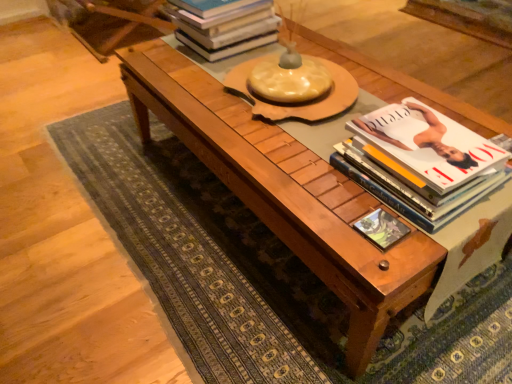
Question: Is hardcover books at upper center, which is the 1th book in top-to-bottom order, to the right of white glossy book at right, which is the 2th book in back-to-front order, from the viewer's perspective?

Choices:
 (A) no
 (B) yes

Answer: (A)

Question: Is hardcover books at upper center, positioned as the 2th book in right-to-left order, to the left of white glossy book at right, the 2th book from the top, from the viewer's perspective?

Choices:
 (A) no
 (B) yes

Answer: (B)

Question: Would you say hardcover books at upper center, which is counted as the 1th book, starting from the left, is a long distance from white glossy book at right, which is counted as the 1th book, starting from the front?

Choices:
 (A) no
 (B) yes

Answer: (A)

Question: From the image's perspective, is hardcover books at upper center, acting as the second book starting from the front, on white glossy book at right, positioned as the second book in left-to-right order?

Choices:
 (A) no
 (B) yes

Answer: (B)

Question: From a real-world perspective, is hardcover books at upper center, positioned as the 2th book in right-to-left order, below white glossy book at right, positioned as the second book in left-to-right order?

Choices:
 (A) yes
 (B) no

Answer: (B)

Question: Looking at the image, does hardcover books at upper center, which is counted as the 1th book, starting from the left, seem bigger or smaller compared to matte green book at center?

Choices:
 (A) small
 (B) big

Answer: (B)

Question: Is hardcover books at upper center, which is counted as the 1th book, starting from the left, in front of or behind matte green book at center in the image?

Choices:
 (A) behind
 (B) front

Answer: (A)

Question: Based on their positions, is hardcover books at upper center, positioned as the 2th book in right-to-left order, located to the left or right of matte green book at center?

Choices:
 (A) right
 (B) left

Answer: (B)

Question: From a real-world perspective, relative to matte green book at center, is hardcover books at upper center, positioned as the 2th book in right-to-left order, vertically above or below?

Choices:
 (A) below
 (B) above

Answer: (B)

Question: Based on their sizes in the image, would you say wooden coffee table at center is bigger or smaller than white glossy book at right, positioned as the second book in left-to-right order?

Choices:
 (A) big
 (B) small

Answer: (A)

Question: Considering the positions of wooden coffee table at center and white glossy book at right, which is the 1th book from bottom to top, in the image, is wooden coffee table at center taller or shorter than white glossy book at right, which is the 1th book from bottom to top,?

Choices:
 (A) short
 (B) tall

Answer: (B)

Question: From the image's perspective, is wooden coffee table at center positioned above or below white glossy book at right, the first book positioned from the right?

Choices:
 (A) above
 (B) below

Answer: (A)

Question: Is point (365, 357) positioned closer to the camera than point (428, 200)?

Choices:
 (A) closer
 (B) farther

Answer: (B)

Question: From the image's perspective, relative to wooden coffee table at center, is matte green book at center above or below?

Choices:
 (A) below
 (B) above

Answer: (A)

Question: Is matte green book at center to the left or to the right of wooden coffee table at center in the image?

Choices:
 (A) left
 (B) right

Answer: (B)